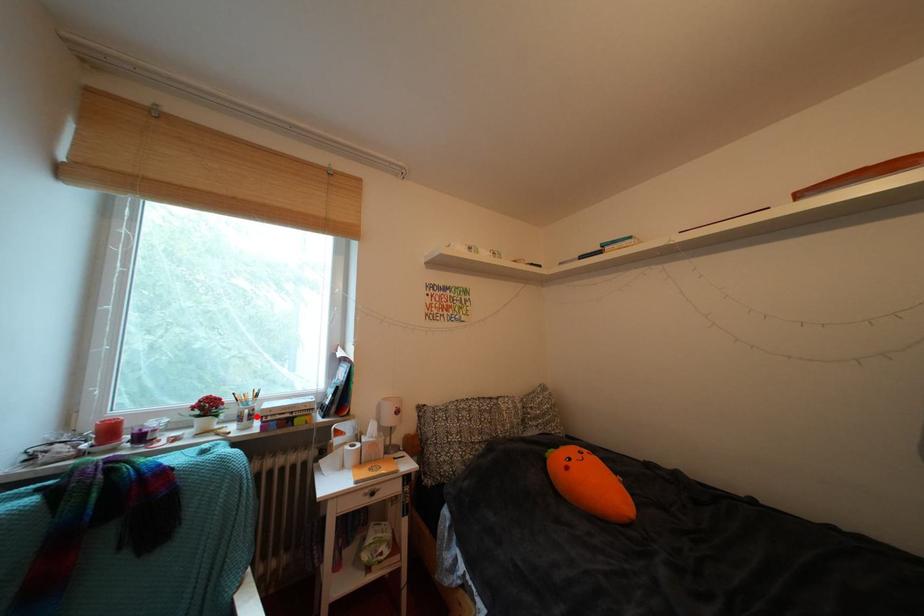
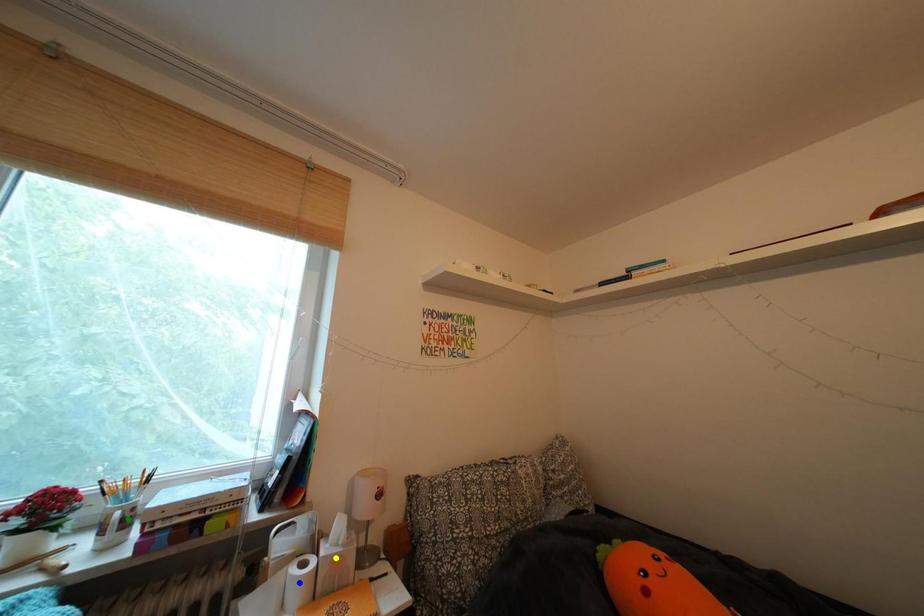
Question: I am providing you with two images of the same scene from different viewpoints. A red point is marked on the first image. You are given multiple points on the second image. Which point in image 2 is actually the same real-world point as the red point in image 1?

Choices:
 (A) yellow point
 (B) blue point
 (C) green point

Answer: (C)